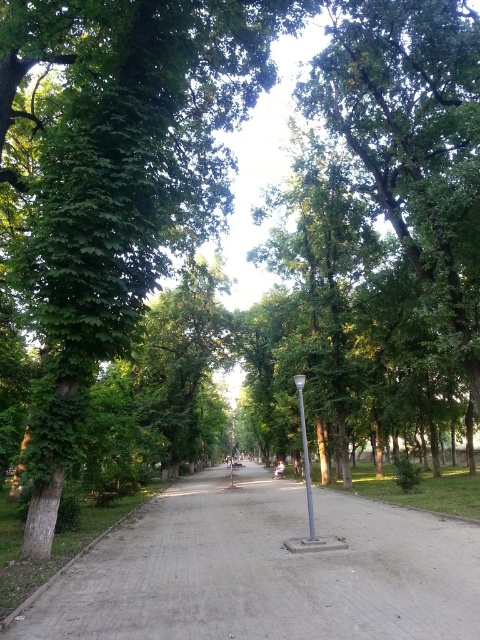
Is gray concrete pavement at center thinner than silver metallic pole at center?

No.

I want to click on gray concrete pavement at center, so click(264, 570).